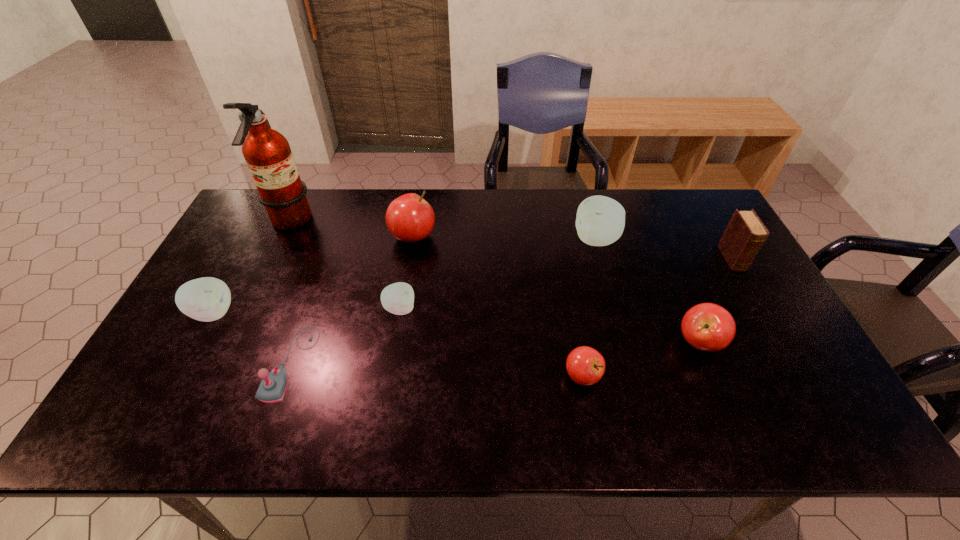
I want to click on apple object that ranks as the fifth closest to the leftmost white apple, so click(x=709, y=327).

At what (x,y) coordinates should I click in order to perform the action: click on white apple that is the closest to the gray joystick. Please return your answer as a coordinate pair (x, y). This screenshot has height=540, width=960. Looking at the image, I should click on (207, 299).

The height and width of the screenshot is (540, 960). I want to click on white apple that is the third closest to the gray joystick, so click(600, 221).

This screenshot has width=960, height=540. What are the coordinates of `the second closest red apple relative to the leftmost white apple` in the screenshot? It's located at (585, 365).

Locate which red apple is the second closest to the sixth object from left to right. Please provide its 2D coordinates. Your answer should be formatted as a tuple, i.e. [(x, y)], where the tuple contains the x and y coordinates of a point satisfying the conditions above.

[(409, 218)]

Find the location of a particular element. free location that satisfies the following two spatial constraints: 1. on the back side of the biggest red apple; 2. on the right side of the leftmost white apple is located at coordinates (254, 237).

Image resolution: width=960 pixels, height=540 pixels. I want to click on free space that satisfies the following two spatial constraints: 1. on the nozzle and handle of the tallest object; 2. on the back side of the rightmost red apple, so click(232, 342).

Image resolution: width=960 pixels, height=540 pixels. In order to click on vacant space that satisfies the following two spatial constraints: 1. on the back side of the joystick; 2. on the left side of the biggest white apple in this screenshot , I will do `click(334, 240)`.

Find the location of a particular element. The image size is (960, 540). free space that satisfies the following two spatial constraints: 1. on the nozzle and handle of the farthest red apple; 2. on the right side of the tallest object is located at coordinates (282, 237).

Locate an element on the screen. This screenshot has width=960, height=540. vacant point that satisfies the following two spatial constraints: 1. on the nozzle and handle of the tallest object; 2. on the left side of the joystick is located at coordinates (223, 363).